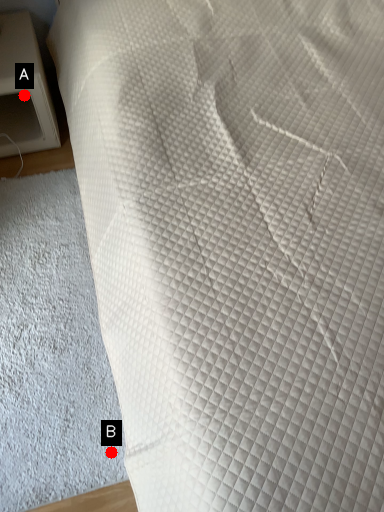
Question: Two points are circled on the image, labeled by A and B beside each circle. Which point appears farthest from the camera in this image?

Choices:
 (A) A is further
 (B) B is further

Answer: (A)